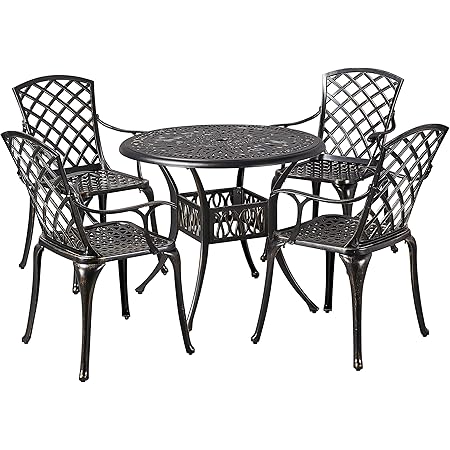
The height and width of the screenshot is (450, 450). What are the coordinates of `front right chair` in the screenshot? It's located at (342, 237).